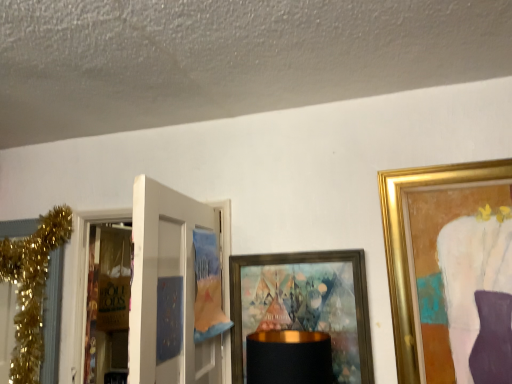
Question: From the image's perspective, is brown paper bag at left below gold-framed artwork at center?

Choices:
 (A) no
 (B) yes

Answer: (A)

Question: Can you confirm if brown paper bag at left is shorter than gold-framed artwork at center?

Choices:
 (A) no
 (B) yes

Answer: (A)

Question: Is brown paper bag at left turned away from gold-framed artwork at center?

Choices:
 (A) yes
 (B) no

Answer: (B)

Question: From a real-world perspective, is brown paper bag at left under gold-framed artwork at center?

Choices:
 (A) yes
 (B) no

Answer: (B)

Question: From a real-world perspective, is brown paper bag at left on top of gold-framed artwork at center?

Choices:
 (A) yes
 (B) no

Answer: (A)

Question: Is the depth of brown paper bag at left greater than that of gold-framed artwork at center?

Choices:
 (A) no
 (B) yes

Answer: (B)

Question: Does gold-framed artwork at center turn towards gold glitter garland at left?

Choices:
 (A) yes
 (B) no

Answer: (B)

Question: Is gold-framed artwork at center closer to the viewer compared to gold glitter garland at left?

Choices:
 (A) no
 (B) yes

Answer: (B)

Question: From a real-world perspective, is gold-framed artwork at center on top of gold glitter garland at left?

Choices:
 (A) no
 (B) yes

Answer: (A)

Question: Is gold-framed artwork at center bigger than gold glitter garland at left?

Choices:
 (A) yes
 (B) no

Answer: (B)

Question: Considering the relative sizes of gold-framed artwork at center and gold glitter garland at left in the image provided, is gold-framed artwork at center taller than gold glitter garland at left?

Choices:
 (A) yes
 (B) no

Answer: (B)

Question: Does gold-framed artwork at center appear on the left side of gold glitter garland at left?

Choices:
 (A) no
 (B) yes

Answer: (A)

Question: Is gold glitter garland at left bigger than brown paper bag at left?

Choices:
 (A) no
 (B) yes

Answer: (B)